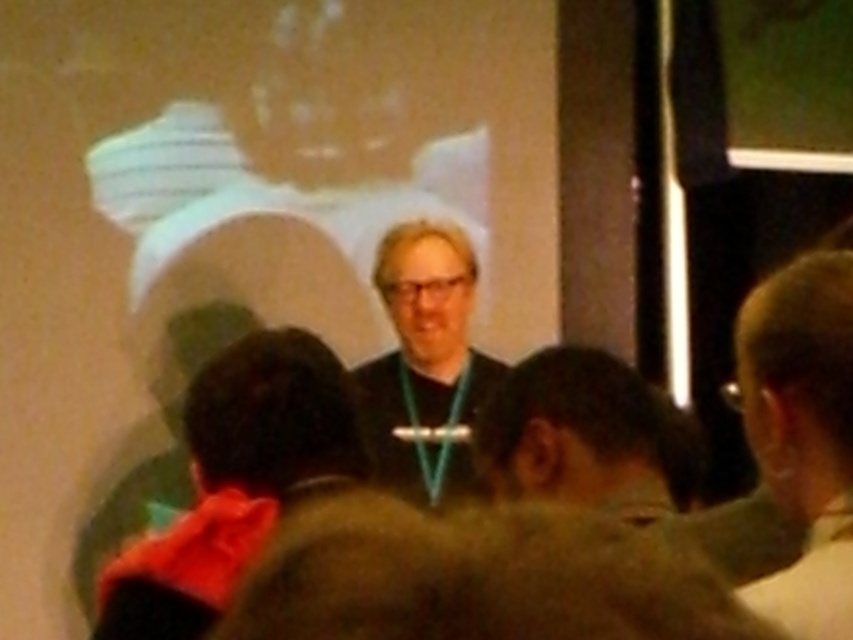
You are an attendee at the presentation. You want to move from your current position to the front of the room to ask a question. The speaker is standing at point (428,300). There is another attendee at point (618,506). Which attendee is closer to the speaker?

Point (618,506) is in front of point (428,300), so the attendee at point (618,506) is closer to the speaker.

You are an attendee at the lecture. You notice two features of the speaker at the center of the image. Which one is narrower in width between the dark brown hair at center and the matte black shirt at center?

The dark brown hair at center is narrower in width compared to the matte black shirt at center.